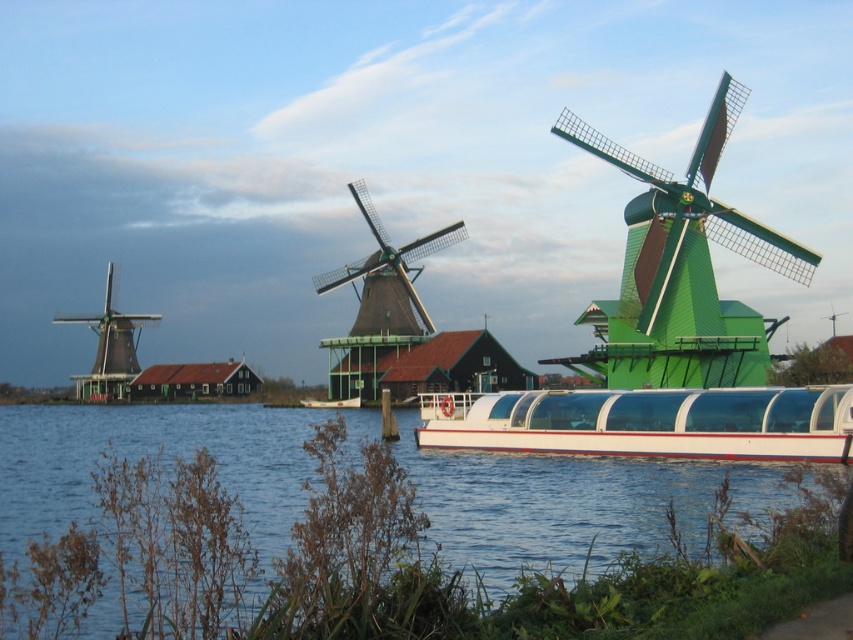
You are standing on the grassy area in the foreground of the image. You see the blue water at lower center and the green wooden windmill at left. Which object is positioned to the right of the other?

The blue water at lower center is positioned to the right of the green wooden windmill at left.

You are standing at the viewpoint of the image and want to determine which of the two points, point (747,604) or point (738,102), is closer to you. Based on the scene, which point is nearer?

Point (747,604) is closer to the viewer than point (738,102).

You are a small toy boat that is 1 meter wide. You want to sail from the blue water at lower center to the green matte windmill at center. Can you pass through the area between them?

The blue water at lower center might be wider than green matte windmill at center, so it is possible that the toy boat can pass through the area between them if the width is sufficient. However, the exact width isn not specified, so there is uncertainty.